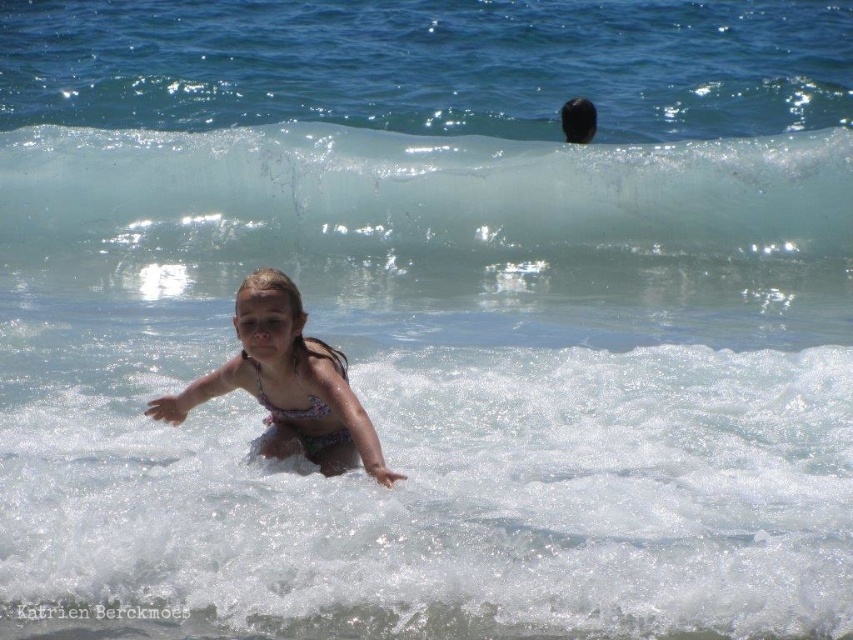
Question: Is clear glass wave at upper center closer to the viewer compared to multicolored bikini at center?

Choices:
 (A) yes
 (B) no

Answer: (B)

Question: Is clear glass wave at upper center to the right of multicolored bikini at center from the viewer's perspective?

Choices:
 (A) no
 (B) yes

Answer: (B)

Question: Does clear glass wave at upper center have a greater width compared to multicolored bikini at center?

Choices:
 (A) yes
 (B) no

Answer: (A)

Question: Which of the following is the closest to the observer?

Choices:
 (A) clear glass wave at upper center
 (B) multicolored bikini at center

Answer: (B)